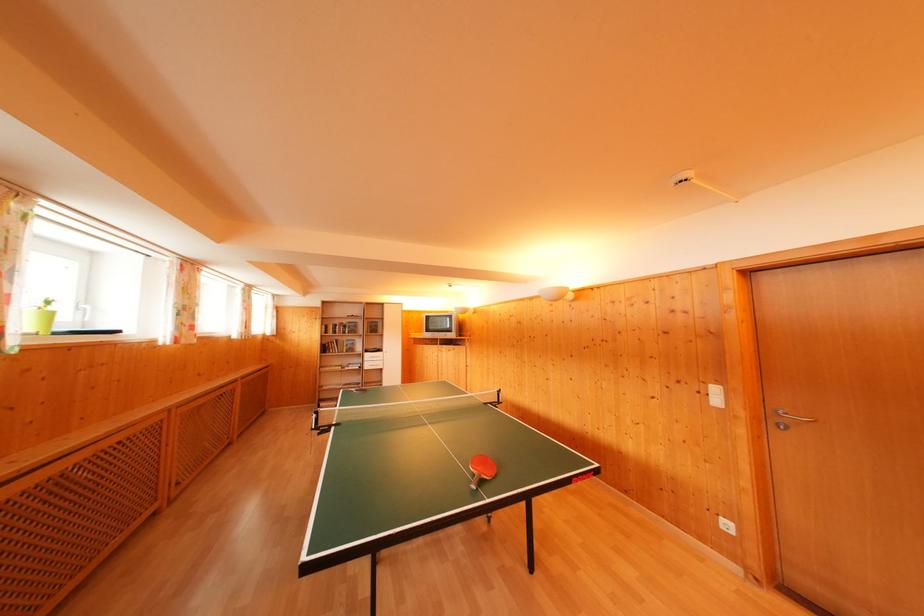
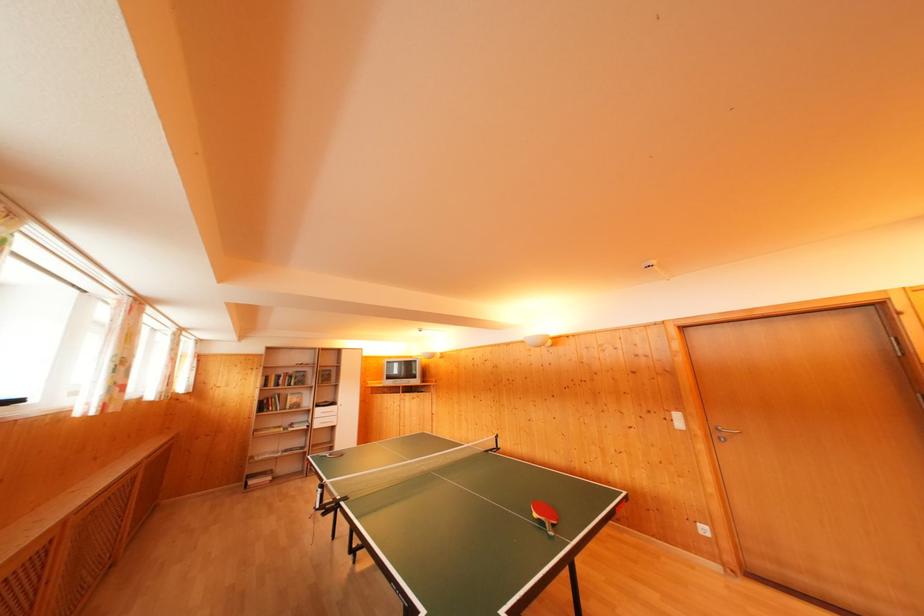
The point at [733,531] is marked in the first image. Where is the corresponding point in the second image?

(709, 535)